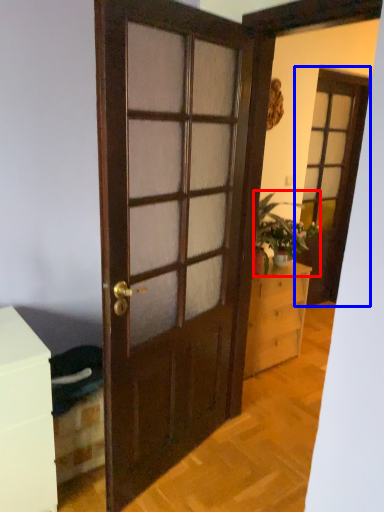
Question: Which object is further to the camera taking this photo, houseplant (highlighted by a red box) or screen door (highlighted by a blue box)?

Choices:
 (A) houseplant
 (B) screen door

Answer: (B)